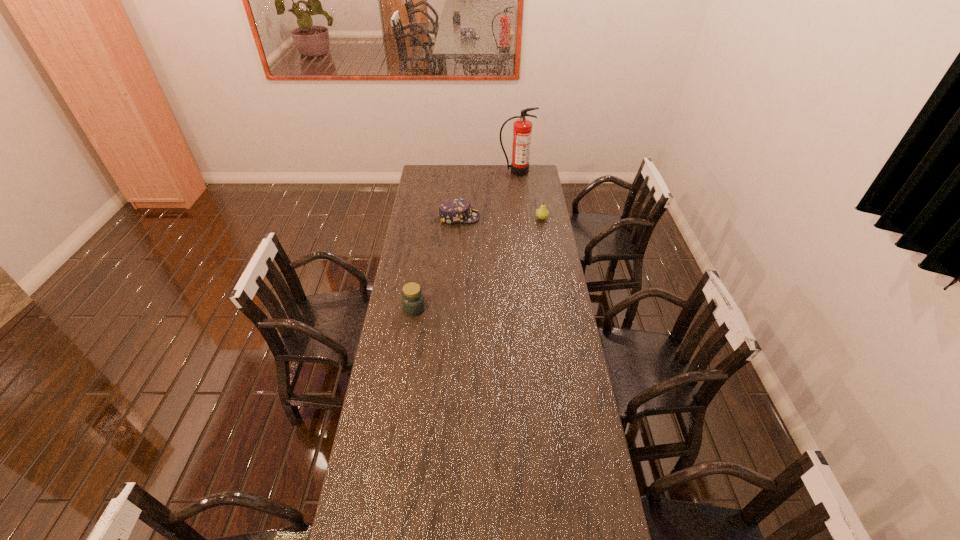
Find the location of `object that is at the far edge`. object that is at the far edge is located at coordinates (522, 128).

Identify the location of jar that is at the left edge. (413, 303).

This screenshot has width=960, height=540. Find the location of `headwear that is at the left edge`. headwear that is at the left edge is located at coordinates (455, 210).

Find the location of a particular element. Image resolution: width=960 pixels, height=540 pixels. fire extinguisher located in the right edge section of the desktop is located at coordinates (522, 128).

You are a GUI agent. You are given a task and a screenshot of the screen. Output one action in this format:
    pyautogui.click(x=<x>, y=<y>)
    Task: Click on the pear that is at the right edge
    This screenshot has width=960, height=540.
    Given the screenshot: What is the action you would take?
    pyautogui.click(x=542, y=213)

The height and width of the screenshot is (540, 960). Identify the location of object that is at the far right corner. (522, 128).

This screenshot has height=540, width=960. What are the coordinates of `vacant space at the far edge of the desktop` in the screenshot? It's located at (467, 179).

The image size is (960, 540). I want to click on free location at the left edge of the desktop, so click(x=436, y=204).

Locate an element on the screen. Image resolution: width=960 pixels, height=540 pixels. vacant area at the right edge of the desktop is located at coordinates coord(522,207).

Identify the location of blank space at the far left corner. The image size is (960, 540). (440, 183).